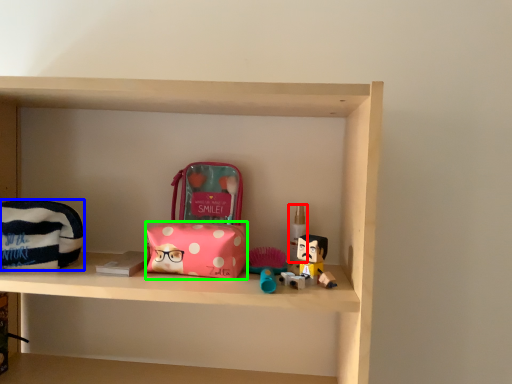
Question: Which is nearer to the toiletry (highlighted by a red box)? pouch (highlighted by a blue box) or package (highlighted by a green box).

Choices:
 (A) pouch
 (B) package

Answer: (B)